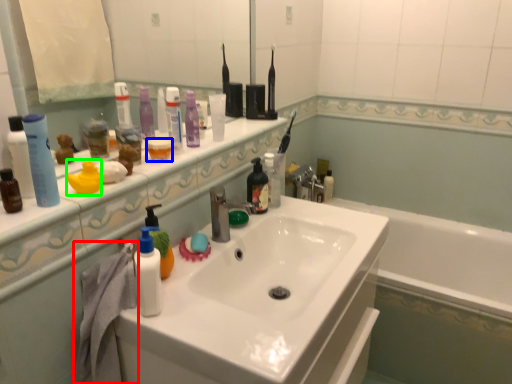
Question: Estimate the real-world distances between objects in this image. Which object is closer to bath towel (highlighted by a red box), mouthwash (highlighted by a blue box) or toiletry (highlighted by a green box)?

Choices:
 (A) mouthwash
 (B) toiletry

Answer: (B)